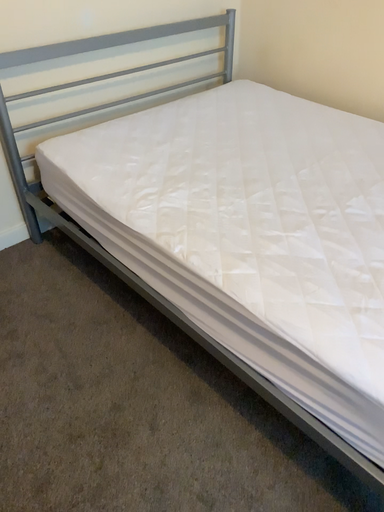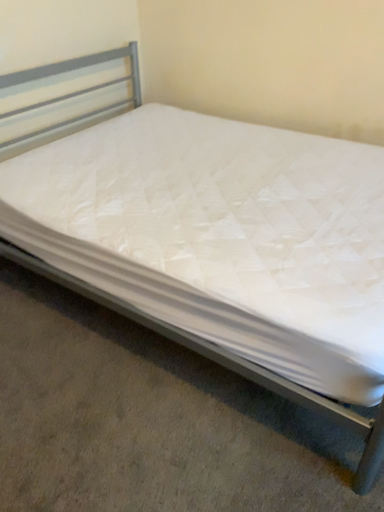
Question: How did the camera likely rotate when shooting the video?

Choices:
 (A) rotated right
 (B) rotated left

Answer: (A)